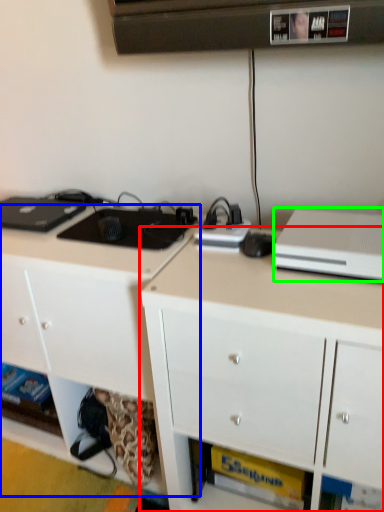
Question: Based on their relative distances, which object is nearer to cabinetry (highlighted by a red box)? Choose from cabinetry (highlighted by a blue box) and desktop computer (highlighted by a green box).

Choices:
 (A) cabinetry
 (B) desktop computer

Answer: (B)